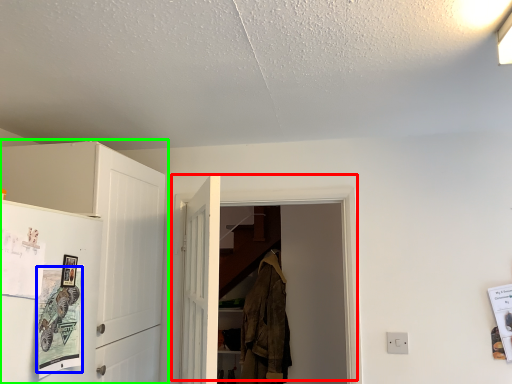
Question: Estimate the real-world distances between objects in this image. Which object is closer to door (highlighted by a red box), poster (highlighted by a blue box) or cabinetry (highlighted by a green box)?

Choices:
 (A) poster
 (B) cabinetry

Answer: (B)